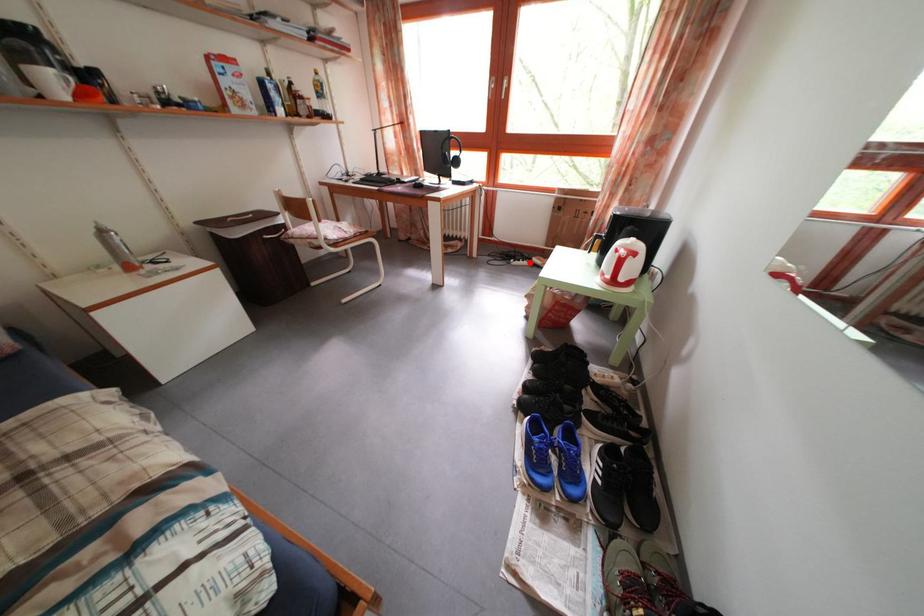
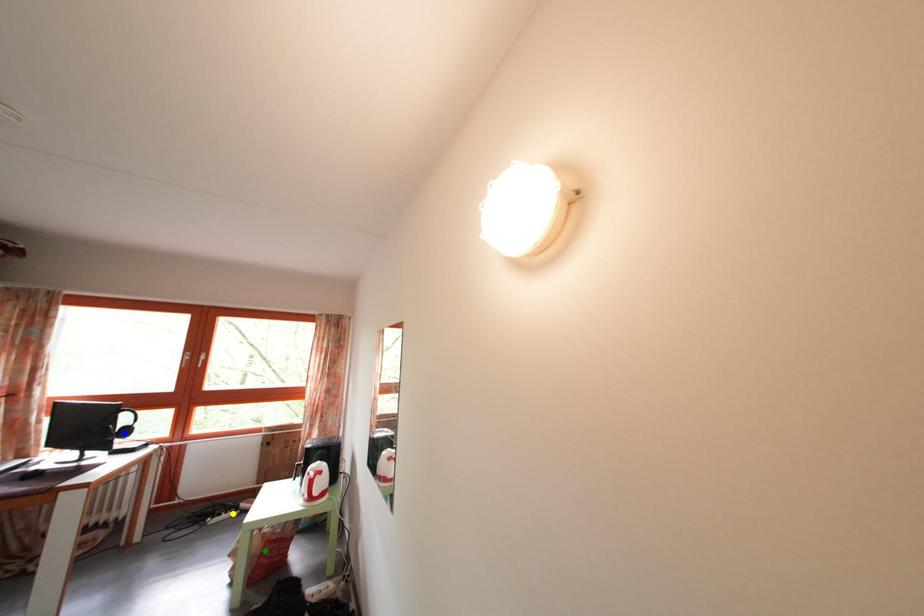
Question: I am providing you with two images of the same scene from different viewpoints. A red point is marked on the first image. You are given multiple points on the second image. Which point in image 2 represents the same 3d spot as the red point in image 1?

Choices:
 (A) green point
 (B) yellow point
 (C) blue point

Answer: (B)